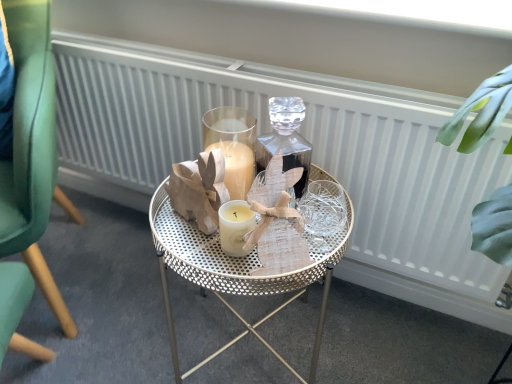
Question: From the image's perspective, relative to white textured radiator at center, is green velvet chair at left above or below?

Choices:
 (A) above
 (B) below

Answer: (A)

Question: Which is correct: green velvet chair at left is inside white textured radiator at center, or outside of it?

Choices:
 (A) outside
 (B) inside

Answer: (A)

Question: Estimate the real-world distances between objects in this image. Which object is closer to the white textured radiator at center?

Choices:
 (A) metallic gold table at center
 (B) green velvet chair at left

Answer: (A)

Question: Which object is the farthest from the metallic gold table at center?

Choices:
 (A) green velvet chair at left
 (B) white textured radiator at center

Answer: (A)